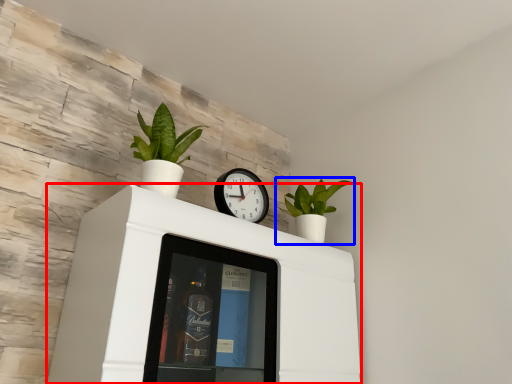
Question: Which object is further to the camera taking this photo, furniture (highlighted by a red box) or houseplant (highlighted by a blue box)?

Choices:
 (A) furniture
 (B) houseplant

Answer: (B)